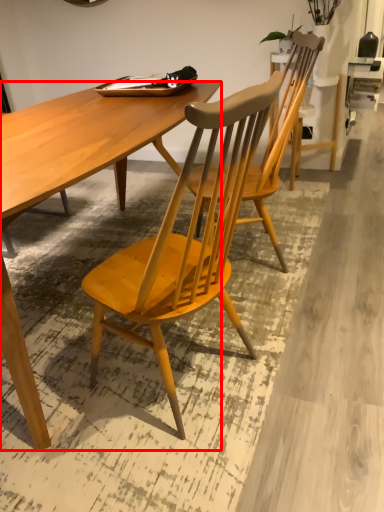
Question: From the image's perspective, what is the correct spatial relationship of desk (annotated by the red box) in relation to chair?

Choices:
 (A) below
 (B) above

Answer: (A)